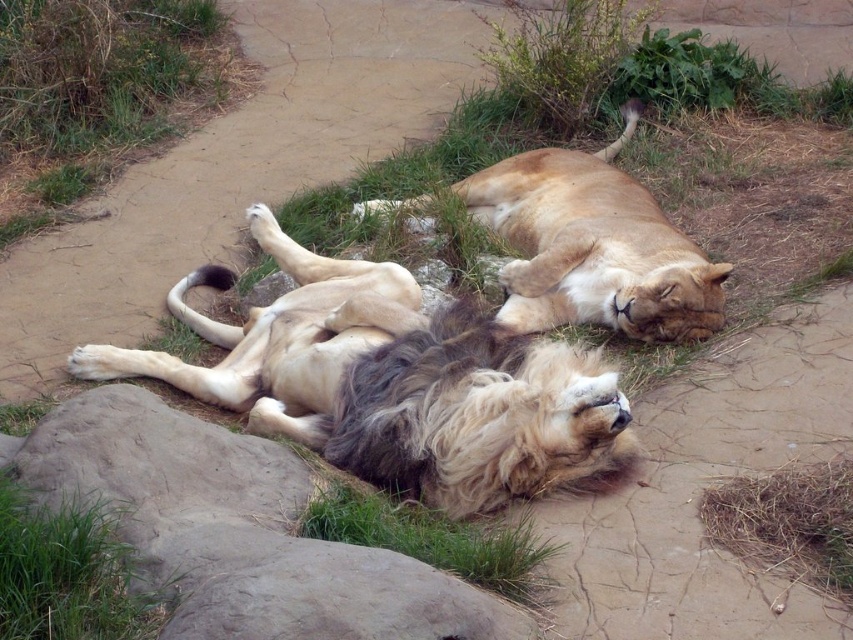
You are a small animal trying to cross from the green grass at lower left to the green soft grass at lower center. The pathway between them is narrow. If your body is 12 inches wide, can you safely cross the gap between them without falling?

The green grass at lower left is 35.83 inches away from green soft grass at lower center. Since your body is only 12 inches wide, you can safely cross the gap between them as the distance is more than enough to accommodate your width.

You are standing at the edge of the sandy pathway looking towards the lions. Which direction should you move to first reach the golden fur lion at center before the green grass at lower left?

You should move to the right because the golden fur lion at center is located to the right of the green grass at lower left, so reaching it first requires moving in that direction.